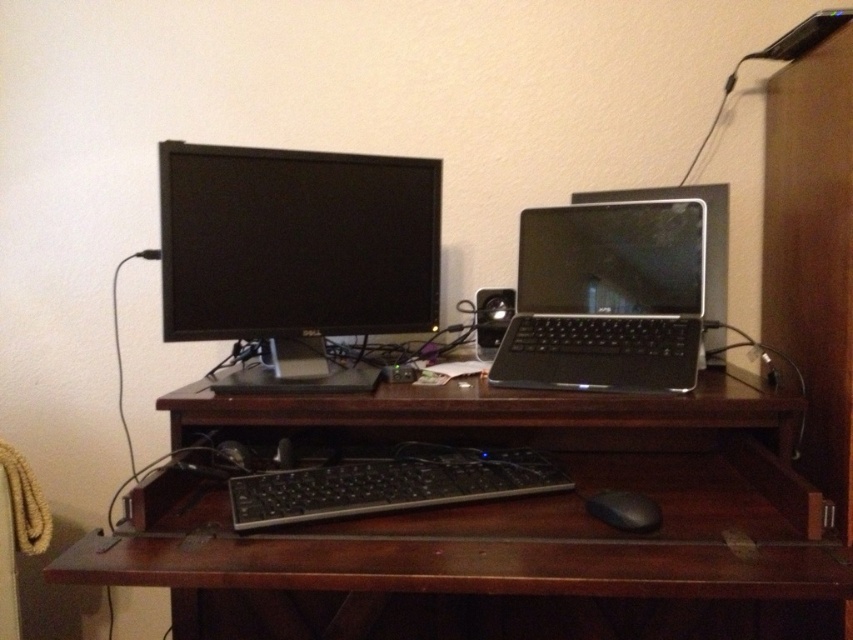
You are setting up a new monitor on your desk. You have a matte black monitor at center and a black matte laptop at center. Which device should you place higher to ensure proper cable management?

The matte black monitor at center should be placed higher than the black matte laptop at center because the matte black monitor at center is above the black matte laptop at center in the current setup.

You are setting up a new monitor and laptop on your desk. You have a matte black monitor at center and a black matte laptop at center. Which device has a larger width?

The matte black monitor at center has a larger width than the black matte laptop at center according to the description.

You are organizing cables under the desk and need to connect a new cable to a device located at point (248, 228) and another device at point (503, 317). Which device should you connect first if you want to start from the one closer to you?

You should connect the device at point (248, 228) first because it is closer to you than the device at point (503, 317).